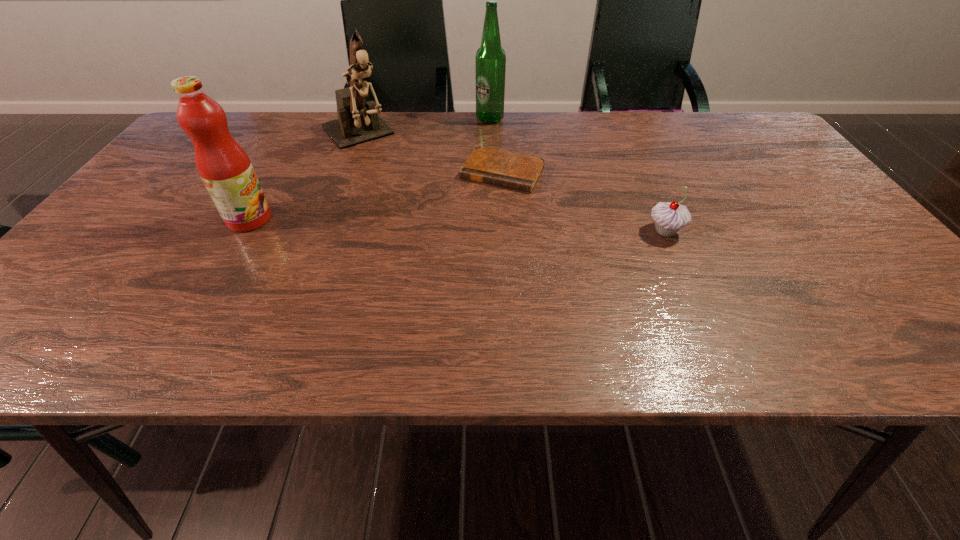
At what (x,y) coordinates should I click in order to perform the action: click on free space that is in between the second object from left to right and the beer bottle. Please return your answer as a coordinate pair (x, y). Looking at the image, I should click on (423, 126).

Where is `free area in between the shortest object and the leftmost object`? free area in between the shortest object and the leftmost object is located at coordinates (376, 195).

Identify the location of free space between the shortest object and the beer bottle. (496, 145).

Identify the location of unoccupied position between the diary and the leftmost object. (376, 195).

I want to click on vacant region between the shortest object and the leftmost object, so click(376, 195).

Locate an element on the screen. object that stands as the fourth closest to the fruit juice is located at coordinates (669, 218).

Locate which object is the second closest to the fruit juice. Please provide its 2D coordinates. Your answer should be formatted as a tuple, i.e. [(x, y)], where the tuple contains the x and y coordinates of a point satisfying the conditions above.

[(501, 168)]

Identify the location of free region that satisfies the following two spatial constraints: 1. on the back side of the beer bottle; 2. on the right side of the fourth object from right to left. This screenshot has height=540, width=960. (362, 119).